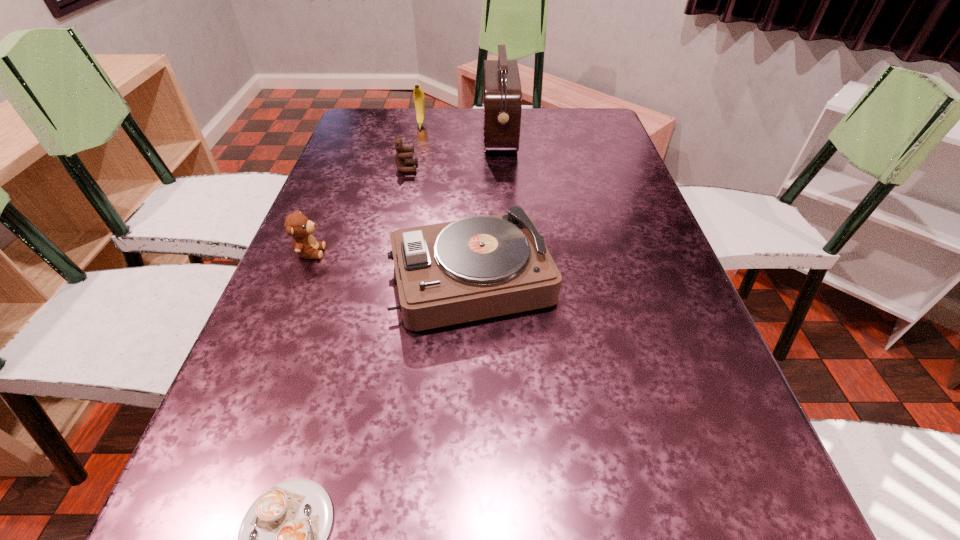
The image size is (960, 540). In order to click on the tallest object in this screenshot , I will do `click(502, 87)`.

The width and height of the screenshot is (960, 540). What are the coordinates of `the fifth shortest object` in the screenshot? It's located at (419, 99).

At what (x,y) coordinates should I click in order to perform the action: click on record player. Please return your answer as a coordinate pair (x, y). Image resolution: width=960 pixels, height=540 pixels. Looking at the image, I should click on (478, 267).

Identify the location of the leftmost object. The width and height of the screenshot is (960, 540). (297, 225).

You are a GUI agent. You are given a task and a screenshot of the screen. Output one action in this format:
    pyautogui.click(x=<x>, y=<y>)
    Task: Click on the left teddy bear
    The height and width of the screenshot is (540, 960).
    Given the screenshot: What is the action you would take?
    pyautogui.click(x=297, y=225)

The height and width of the screenshot is (540, 960). Find the location of `the fourth nearest object`. the fourth nearest object is located at coordinates pos(404,156).

Where is `the right teddy bear`? Image resolution: width=960 pixels, height=540 pixels. the right teddy bear is located at coordinates (404, 156).

Locate an element on the screen. The image size is (960, 540). free region located on the front panel of the tallest object is located at coordinates (428, 135).

The height and width of the screenshot is (540, 960). What are the coordinates of `free location located on the front panel of the tallest object` in the screenshot? It's located at (354, 135).

The width and height of the screenshot is (960, 540). I want to click on free region located on the front panel of the tallest object, so click(373, 135).